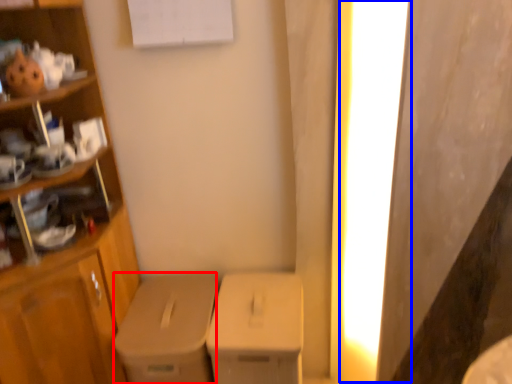
Question: Which object is closer to the camera taking this photo, cardboard box (highlighted by a red box) or lighting (highlighted by a blue box)?

Choices:
 (A) cardboard box
 (B) lighting

Answer: (B)